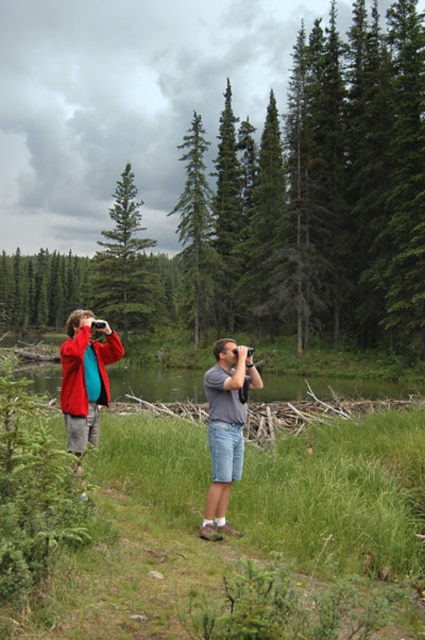
Question: Can you confirm if denim shorts at center is positioned to the left of green matte tree at center?

Choices:
 (A) yes
 (B) no

Answer: (B)

Question: Does green matte tree at upper center have a larger size compared to green matte tree at upper left?

Choices:
 (A) yes
 (B) no

Answer: (B)

Question: Estimate the real-world distances between objects in this image. Which object is farther from the green grassy lake at center?

Choices:
 (A) green matte tree at upper left
 (B) green matte tree at center

Answer: (A)

Question: Which object is the farthest from the green matte tree at upper center?

Choices:
 (A) matte red jacket at left
 (B) denim shorts at center
 (C) green matte tree at center

Answer: (B)

Question: Can you confirm if green grassy lake at center is positioned above green matte tree at upper left?

Choices:
 (A) yes
 (B) no

Answer: (B)

Question: Considering the real-world distances, which object is farthest from the green matte tree at upper center?

Choices:
 (A) matte red jacket at left
 (B) green matte tree at center

Answer: (A)